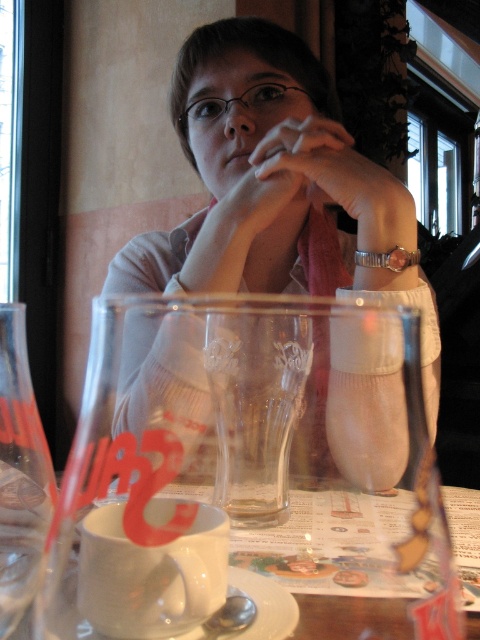
Between matte white sweater at center and white ceramic saucer at lower center, which one is positioned lower?

Positioned lower is white ceramic saucer at lower center.

Does matte white sweater at center have a greater height compared to white ceramic saucer at lower center?

Indeed, matte white sweater at center has a greater height compared to white ceramic saucer at lower center.

Does point (256, 60) come closer to viewer compared to point (253, 600)?

No, (256, 60) is further to viewer.

The width and height of the screenshot is (480, 640). Find the location of `matte white sweater at center`. matte white sweater at center is located at coordinates (274, 182).

Does transparent glass at center have a lesser height compared to white ceramic saucer at lower center?

In fact, transparent glass at center may be taller than white ceramic saucer at lower center.

Does point (16, 428) come closer to viewer compared to point (227, 632)?

No, (16, 428) is further to viewer.

Describe the element at coordinates (20, 474) in the screenshot. I see `transparent glass at center` at that location.

What are the coordinates of `transparent glass at center` in the screenshot? It's located at (20, 474).

Does matte white sweater at center appear under matte skin hand at center?

Yes.

Between matte white sweater at center and matte skin hand at center, which one is positioned higher?

matte skin hand at center is higher up.

Is point (321, 116) less distant than point (384, 170)?

No, it is not.

Where is `matte white sweater at center`? matte white sweater at center is located at coordinates (274, 182).